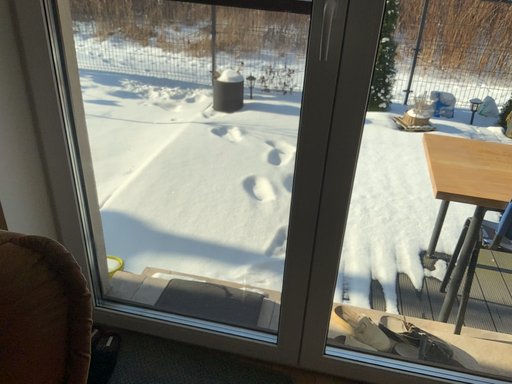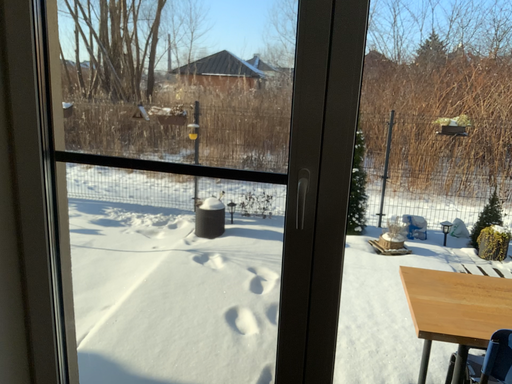
Question: Which way did the camera rotate in the video?

Choices:
 (A) rotated upward
 (B) rotated downward

Answer: (A)